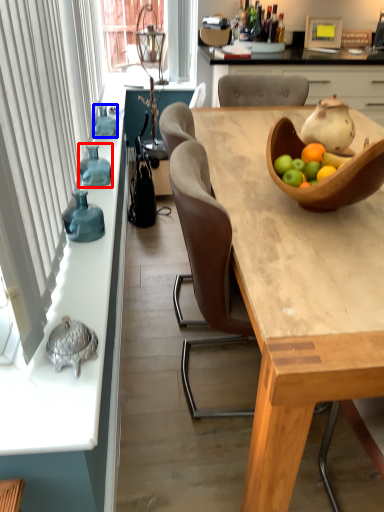
Question: Which point is further to the camera, vase (highlighted by a red box) or bottle (highlighted by a blue box)?

Choices:
 (A) vase
 (B) bottle

Answer: (B)